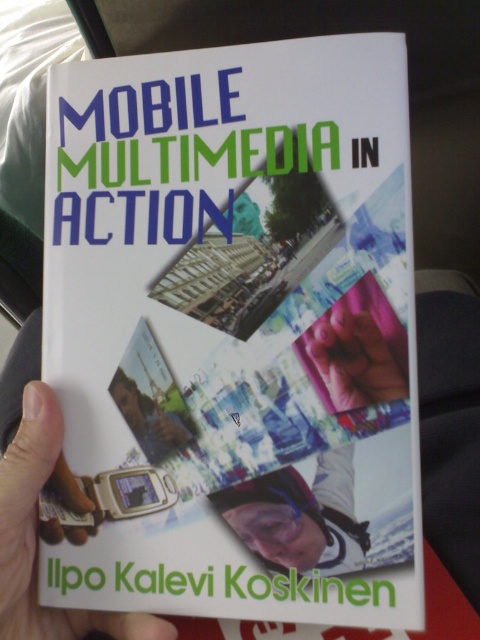
Does white matte phone at lower left have a smaller size compared to matte plastic phone at lower left?

Incorrect, white matte phone at lower left is not smaller in size than matte plastic phone at lower left.

Who is lower down, white matte phone at lower left or matte plastic phone at lower left?

white matte phone at lower left

Does point (16, 442) lie in front of point (149, 444)?

Yes, point (16, 442) is closer to viewer.

This screenshot has height=640, width=480. I want to click on white matte phone at lower left, so click(x=37, y=538).

Does white matte book at center lie behind matte black helmet at center?

No, white matte book at center is closer to the viewer.

In the scene shown: Can you confirm if white matte book at center is positioned above matte black helmet at center?

Correct, white matte book at center is located above matte black helmet at center.

This screenshot has width=480, height=640. Find the location of `white matte book at center`. white matte book at center is located at coordinates (236, 332).

Which of these two, white matte phone at lower left or matte black helmet at center, stands shorter?

With less height is matte black helmet at center.

The height and width of the screenshot is (640, 480). What do you see at coordinates (37, 538) in the screenshot? I see `white matte phone at lower left` at bounding box center [37, 538].

The image size is (480, 640). I want to click on white matte phone at lower left, so click(37, 538).